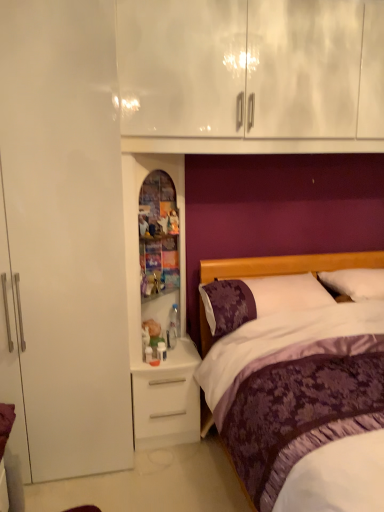
Question: From a real-world perspective, is purple satin pillow at right, which appears as the 2th pillow when viewed from the left, positioned above or below white matte desk at lower center?

Choices:
 (A) above
 (B) below

Answer: (A)

Question: Considering the relative positions of purple satin pillow at right, which appears as the 2th pillow when viewed from the left, and white matte desk at lower center in the image provided, is purple satin pillow at right, which appears as the 2th pillow when viewed from the left, to the left or to the right of white matte desk at lower center?

Choices:
 (A) left
 (B) right

Answer: (B)

Question: Considering the real-world distances, which object is farthest from the white glossy medicine cabinet at center?

Choices:
 (A) white matte desk at lower center
 (B) purple satin pillow at right, the first pillow when ordered from right to left
 (C) purple satin bed at center
 (D) purple floral pillow at right, which appears as the second pillow when viewed from the right

Answer: (B)

Question: Which object is positioned closest to the purple floral pillow at right, the 1th pillow in the left-to-right sequence?

Choices:
 (A) purple satin pillow at right, which appears as the 2th pillow when viewed from the left
 (B) white glossy medicine cabinet at center
 (C) white matte desk at lower center
 (D) purple satin bed at center

Answer: (D)